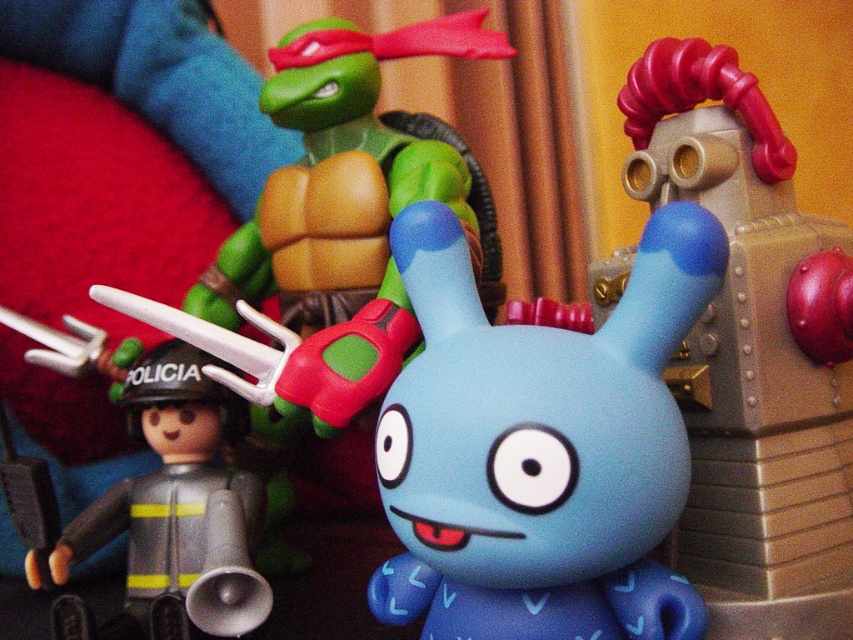
Question: Among these objects, which one is nearest to the camera?

Choices:
 (A) blue matte toy at center
 (B) blue rubber toy at center
 (C) black matte police officer at left

Answer: (A)

Question: Among these objects, which one is farthest from the camera?

Choices:
 (A) blue matte toy at center
 (B) blue rubber toy at center
 (C) black matte police officer at left

Answer: (C)

Question: Does blue matte toy at center appear under black matte police officer at left?

Choices:
 (A) no
 (B) yes

Answer: (A)

Question: Among these objects, which one is nearest to the camera?

Choices:
 (A) blue rubber toy at center
 (B) black matte police officer at left
 (C) blue matte toy at center

Answer: (C)

Question: Does blue matte toy at center appear on the left side of black matte police officer at left?

Choices:
 (A) yes
 (B) no

Answer: (B)

Question: Can you confirm if blue matte toy at center is positioned to the right of blue rubber toy at center?

Choices:
 (A) no
 (B) yes

Answer: (A)